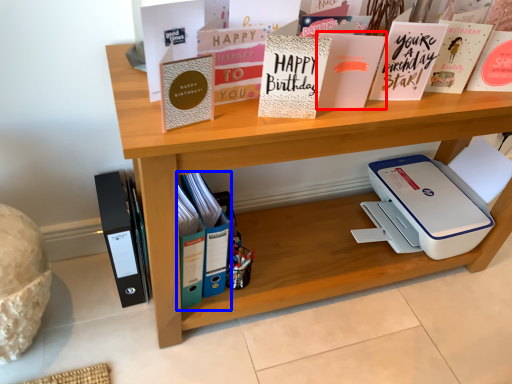
Question: Which object appears closest to the camera in this image, paperback book (highlighted by a red box) or book (highlighted by a blue box)?

Choices:
 (A) paperback book
 (B) book

Answer: (A)